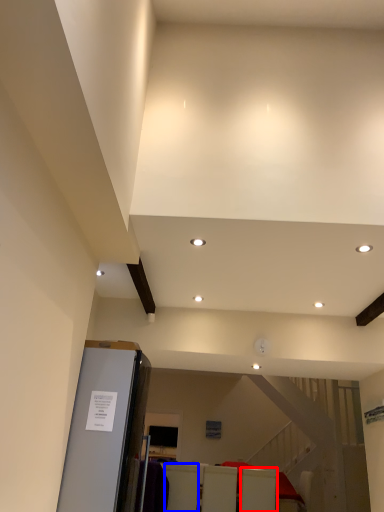
Question: Which object appears closest to the camera in this image, furniture (highlighted by a red box) or furniture (highlighted by a blue box)?

Choices:
 (A) furniture
 (B) furniture

Answer: (B)